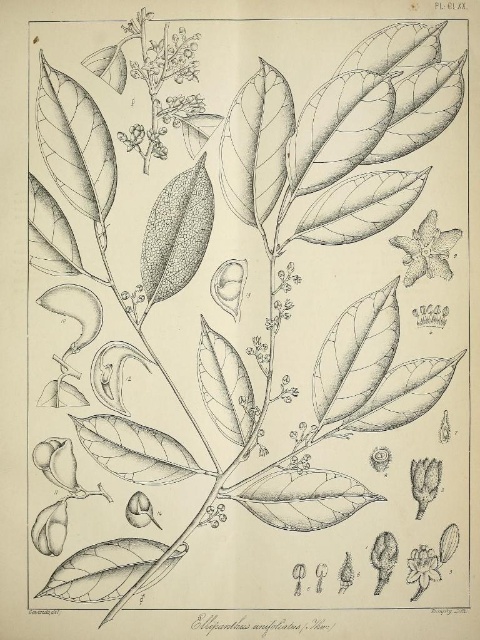
Between smooth white flower at upper right and white paper flower at lower right, which one is positioned lower?

white paper flower at lower right is lower down.

Is smooth white flower at upper right smaller than white paper flower at lower right?

Actually, smooth white flower at upper right might be larger than white paper flower at lower right.

Find the location of `smooth white flower at upper right`. smooth white flower at upper right is located at coordinates (427, 250).

In order to click on smooth white flower at upper right in this screenshot , I will do `click(427, 250)`.